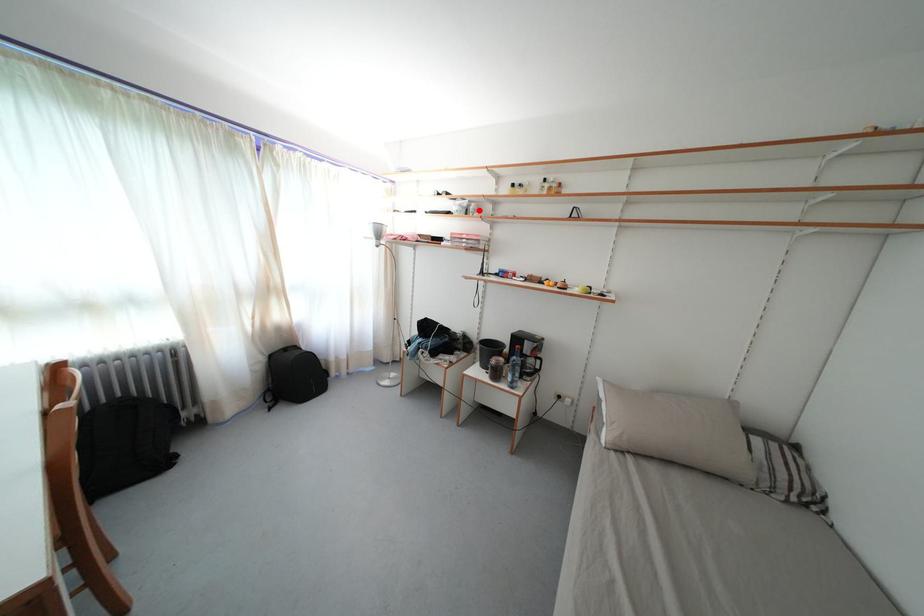
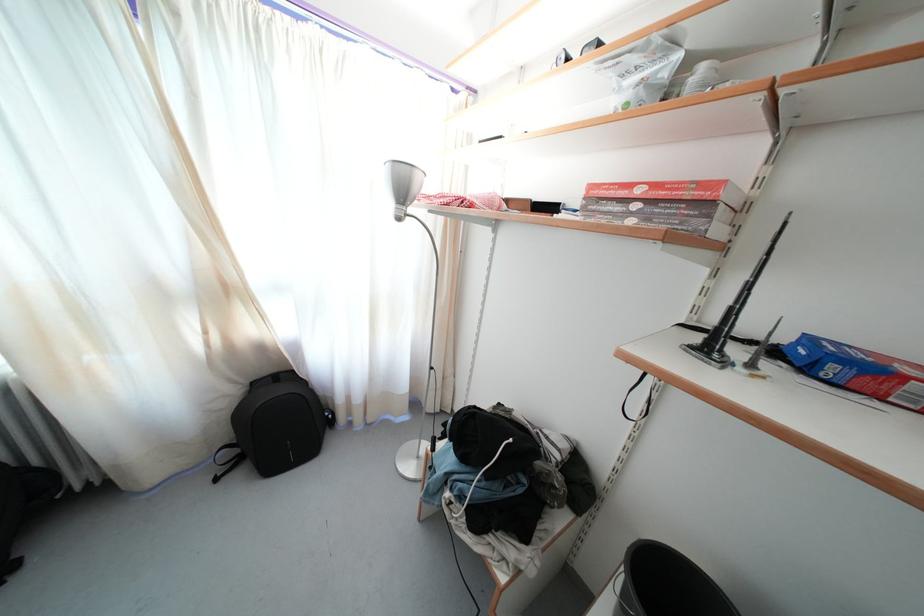
Question: I am providing you with two images of the same scene from different viewpoints. A red point is marked on the first image. Is the red point's position out of view in image 2?

Choices:
 (A) Yes
 (B) No

Answer: (B)